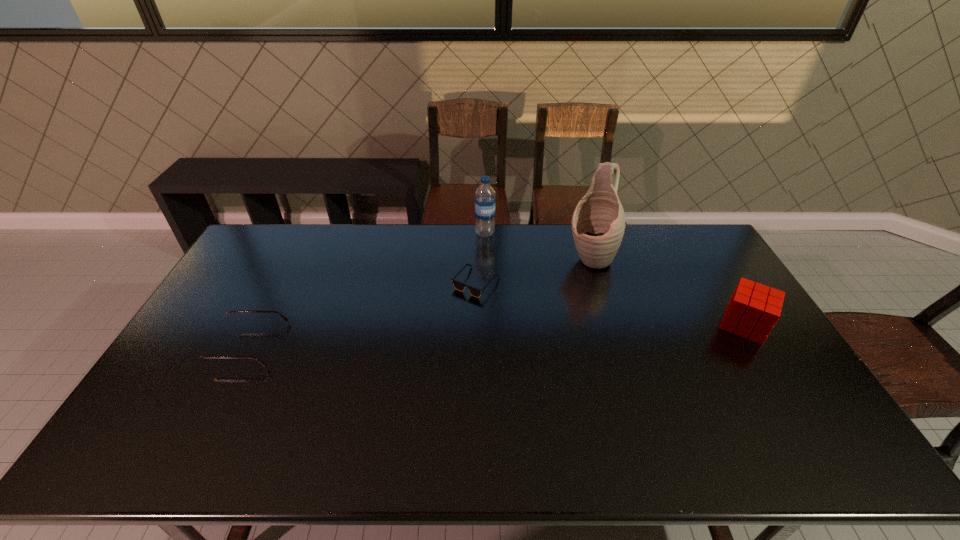
You are a GUI agent. You are given a task and a screenshot of the screen. Output one action in this format:
    pyautogui.click(x=<x>, y=<y>)
    Task: Click on the vacant space situated 0.150m on the label of the fourth shortest object
    
    Given the screenshot: What is the action you would take?
    pyautogui.click(x=486, y=264)

The height and width of the screenshot is (540, 960). I want to click on free point located on the label of the fourth shortest object, so click(488, 301).

Locate an element on the screen. This screenshot has width=960, height=540. pitcher that is at the far edge is located at coordinates (x=598, y=222).

The image size is (960, 540). Find the location of `water bottle that is positioned at the far edge`. water bottle that is positioned at the far edge is located at coordinates (485, 199).

Locate an element on the screen. This screenshot has width=960, height=540. object that is at the left edge is located at coordinates tap(209, 350).

You are a GUI agent. You are given a task and a screenshot of the screen. Output one action in this format:
    pyautogui.click(x=<x>, y=<y>)
    Task: Click on the object that is at the right edge
    The image size is (960, 540).
    Given the screenshot: What is the action you would take?
    pyautogui.click(x=753, y=310)

Find the location of a particular element. This screenshot has height=540, width=960. blank space at the far edge is located at coordinates (550, 261).

At what (x,y) coordinates should I click in order to perform the action: click on free space at the near edge. Please return your answer as a coordinate pair (x, y). The width and height of the screenshot is (960, 540). Looking at the image, I should click on (389, 394).

Locate an element on the screen. The image size is (960, 540). vacant area at the right edge is located at coordinates (774, 352).

Locate an element on the screen. The width and height of the screenshot is (960, 540). unoccupied position between the shortest object and the second object from right to left is located at coordinates coord(533,271).